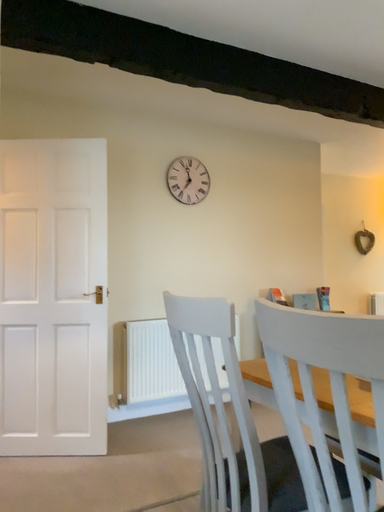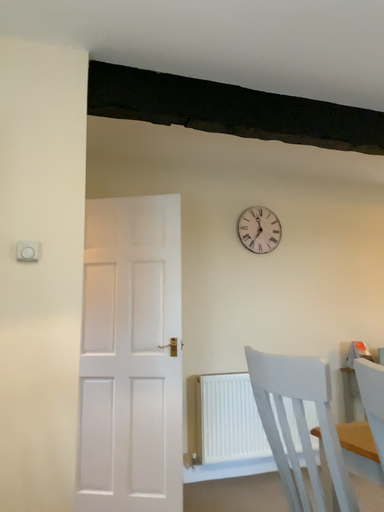
Question: How did the camera likely rotate when shooting the video?

Choices:
 (A) rotated downward
 (B) rotated upward

Answer: (B)